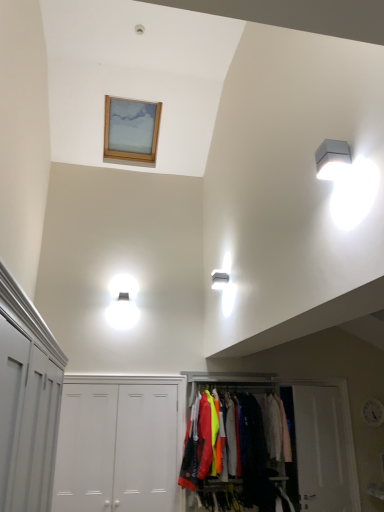
Question: Is matte fabric clothes rack at center looking in the opposite direction of light pink fabric at center?

Choices:
 (A) yes
 (B) no

Answer: (A)

Question: From the image's perspective, is matte fabric clothes rack at center under light pink fabric at center?

Choices:
 (A) no
 (B) yes

Answer: (B)

Question: Is matte fabric clothes rack at center bigger than light pink fabric at center?

Choices:
 (A) no
 (B) yes

Answer: (B)

Question: Is matte fabric clothes rack at center with light pink fabric at center?

Choices:
 (A) yes
 (B) no

Answer: (B)

Question: From a real-world perspective, is matte fabric clothes rack at center located beneath light pink fabric at center?

Choices:
 (A) no
 (B) yes

Answer: (B)

Question: From the image's perspective, is white matte door at center, arranged as the third door when viewed from the left, positioned above or below matte fabric clothes rack at center?

Choices:
 (A) above
 (B) below

Answer: (A)

Question: From their relative heights in the image, would you say white matte door at center, positioned as the 2th door in right-to-left order, is taller or shorter than matte fabric clothes rack at center?

Choices:
 (A) tall
 (B) short

Answer: (B)

Question: Based on their positions, is white matte door at center, positioned as the 2th door in right-to-left order, located to the left or right of matte fabric clothes rack at center?

Choices:
 (A) right
 (B) left

Answer: (B)

Question: In terms of width, does white matte door at center, arranged as the third door when viewed from the left, look wider or thinner when compared to matte fabric clothes rack at center?

Choices:
 (A) wide
 (B) thin

Answer: (B)

Question: Which is correct: white matte door at center, arranged as the third door when viewed from the left, is inside light pink fabric at center, or outside of it?

Choices:
 (A) outside
 (B) inside

Answer: (A)

Question: From the image's perspective, is white matte door at center, arranged as the third door when viewed from the left, positioned above or below light pink fabric at center?

Choices:
 (A) above
 (B) below

Answer: (B)

Question: In the image, is white matte door at center, arranged as the third door when viewed from the left, positioned in front of or behind light pink fabric at center?

Choices:
 (A) front
 (B) behind

Answer: (A)

Question: Considering the positions of white matte door at center, positioned as the 2th door in right-to-left order, and light pink fabric at center in the image, is white matte door at center, positioned as the 2th door in right-to-left order, taller or shorter than light pink fabric at center?

Choices:
 (A) short
 (B) tall

Answer: (B)

Question: From a real-world perspective, is white matte door at center, which is the second door in left-to-right order, physically located above or below matte fabric clothes rack at center?

Choices:
 (A) below
 (B) above

Answer: (B)

Question: From the image's perspective, is white matte door at center, which is the second door in left-to-right order, located above or below matte fabric clothes rack at center?

Choices:
 (A) below
 (B) above

Answer: (B)